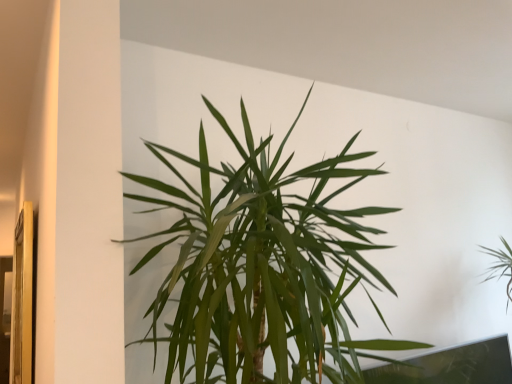
Question: From the image's perspective, is green leafy plant at center, marked as the 1th houseplant in a front-to-back arrangement, on top of green leafy plant at upper right, the 2th houseplant when ordered from front to back?

Choices:
 (A) yes
 (B) no

Answer: (A)

Question: Could you tell me if green leafy plant at center, marked as the 1th houseplant in a front-to-back arrangement, is facing green leafy plant at upper right, the first houseplant in the right-to-left sequence?

Choices:
 (A) yes
 (B) no

Answer: (B)

Question: Is green leafy plant at center, arranged as the 2th houseplant when viewed from the right, at the right side of green leafy plant at upper right, the 2th houseplant when ordered from front to back?

Choices:
 (A) no
 (B) yes

Answer: (A)

Question: Is green leafy plant at center, marked as the 1th houseplant in a front-to-back arrangement, positioned in front of green leafy plant at upper right, the first houseplant in the right-to-left sequence?

Choices:
 (A) yes
 (B) no

Answer: (A)

Question: Does green leafy plant at center, arranged as the 2th houseplant when viewed from the right, appear on the left side of green leafy plant at upper right, the 2th houseplant viewed from the left?

Choices:
 (A) yes
 (B) no

Answer: (A)

Question: From a real-world perspective, is green leafy plant at center, arranged as the 2th houseplant when viewed from the right, on top of green leafy plant at upper right, the first houseplant in the right-to-left sequence?

Choices:
 (A) no
 (B) yes

Answer: (B)

Question: From the image's perspective, is green leafy plant at upper right, the 2th houseplant viewed from the left, under green leafy plant at center, arranged as the 1th houseplant when viewed from the left?

Choices:
 (A) yes
 (B) no

Answer: (A)

Question: Is there a large distance between green leafy plant at upper right, the 2th houseplant viewed from the left, and green leafy plant at center, arranged as the 2th houseplant when viewed from the right?

Choices:
 (A) no
 (B) yes

Answer: (B)

Question: Does green leafy plant at upper right, the 2th houseplant viewed from the left, have a smaller size compared to green leafy plant at center, arranged as the 1th houseplant when viewed from the left?

Choices:
 (A) yes
 (B) no

Answer: (A)

Question: Considering the relative sizes of green leafy plant at upper right, positioned as the first houseplant in back-to-front order, and green leafy plant at center, arranged as the 1th houseplant when viewed from the left, in the image provided, is green leafy plant at upper right, positioned as the first houseplant in back-to-front order, shorter than green leafy plant at center, arranged as the 1th houseplant when viewed from the left,?

Choices:
 (A) yes
 (B) no

Answer: (A)

Question: From a real-world perspective, is green leafy plant at upper right, the 2th houseplant when ordered from front to back, physically above green leafy plant at center, placed as the 2th houseplant when sorted from back to front?

Choices:
 (A) no
 (B) yes

Answer: (A)

Question: From a real-world perspective, is green leafy plant at upper right, the first houseplant in the right-to-left sequence, located beneath green leafy plant at center, placed as the 2th houseplant when sorted from back to front?

Choices:
 (A) no
 (B) yes

Answer: (B)

Question: From the image's perspective, is green leafy plant at upper right, the 2th houseplant viewed from the left, positioned above or below green leafy plant at center, arranged as the 2th houseplant when viewed from the right?

Choices:
 (A) above
 (B) below

Answer: (B)